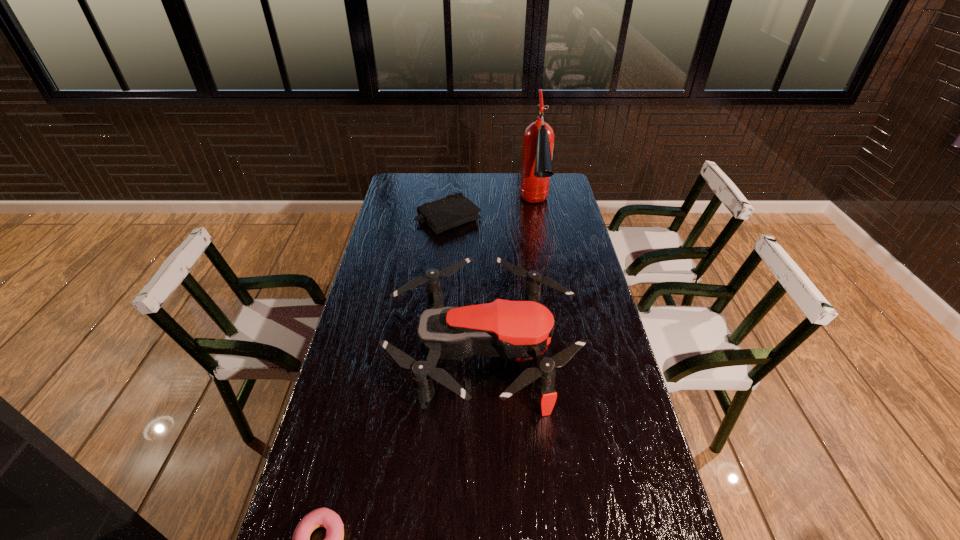
In order to click on drone positioned at the right edge in this screenshot , I will do `click(521, 330)`.

I want to click on object that is positioned at the far right corner, so click(538, 138).

Identify the location of blank space at the far edge of the desktop. (492, 178).

You are a GUI agent. You are given a task and a screenshot of the screen. Output one action in this format:
    pyautogui.click(x=<x>, y=<y>)
    Task: Click on the vacant space at the left edge of the desktop
    This screenshot has width=960, height=540.
    Given the screenshot: What is the action you would take?
    pyautogui.click(x=413, y=225)

This screenshot has height=540, width=960. I want to click on free space at the right edge of the desktop, so click(x=576, y=374).

Identify the location of vacant space at the far left corner of the desktop. The height and width of the screenshot is (540, 960). (412, 177).

Identify the location of unoccupied area between the fire extinguisher and the fourth shortest object. Image resolution: width=960 pixels, height=540 pixels. (509, 280).

In order to click on object that stands as the closest to the tallest object in this screenshot , I will do `click(454, 210)`.

I want to click on object that can be found as the second closest to the leftmost object, so click(x=523, y=539).

At what (x,y) coordinates should I click in order to perform the action: click on free location that satisfies the following two spatial constraints: 1. at the nozzle end of the fire extinguisher; 2. on the camera side of the second tallest object. Please return your answer as a coordinate pair (x, y). Looking at the image, I should click on (561, 353).